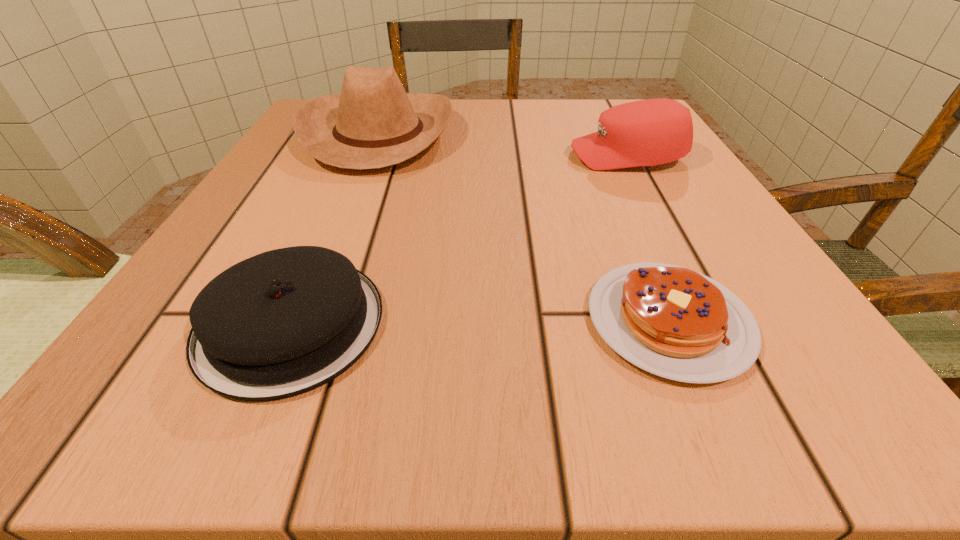
Locate an element on the screen. free space located on the back of the left pancake is located at coordinates [x=371, y=137].

I want to click on vacant space located 0.320m on the left of the shortest object, so click(x=310, y=321).

At what (x,y) coordinates should I click in order to perform the action: click on cowboy hat located in the far edge section of the desktop. Please return your answer as a coordinate pair (x, y). Looking at the image, I should click on (373, 123).

In order to click on cap positioned at the far edge in this screenshot , I will do `click(650, 132)`.

Locate an element on the screen. This screenshot has height=540, width=960. cowboy hat that is positioned at the left edge is located at coordinates (373, 123).

Where is `pancake at the left edge`? pancake at the left edge is located at coordinates (284, 322).

Locate an element on the screen. The image size is (960, 540). cap that is at the right edge is located at coordinates (650, 132).

What are the coordinates of `pancake that is at the right edge` in the screenshot? It's located at (671, 321).

Image resolution: width=960 pixels, height=540 pixels. I want to click on object that is positioned at the far left corner, so pos(373,123).

This screenshot has width=960, height=540. Identify the location of object that is at the near left corner. (284, 322).